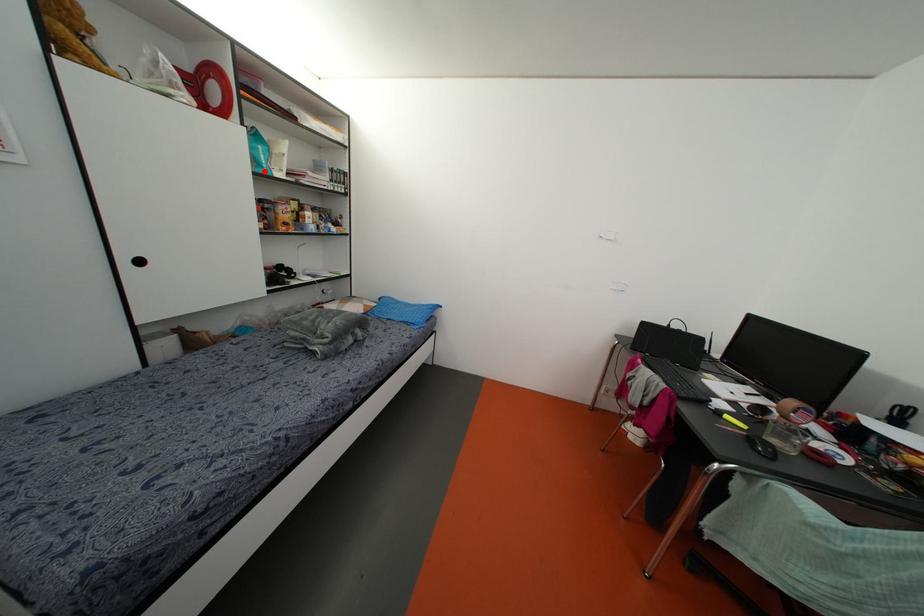
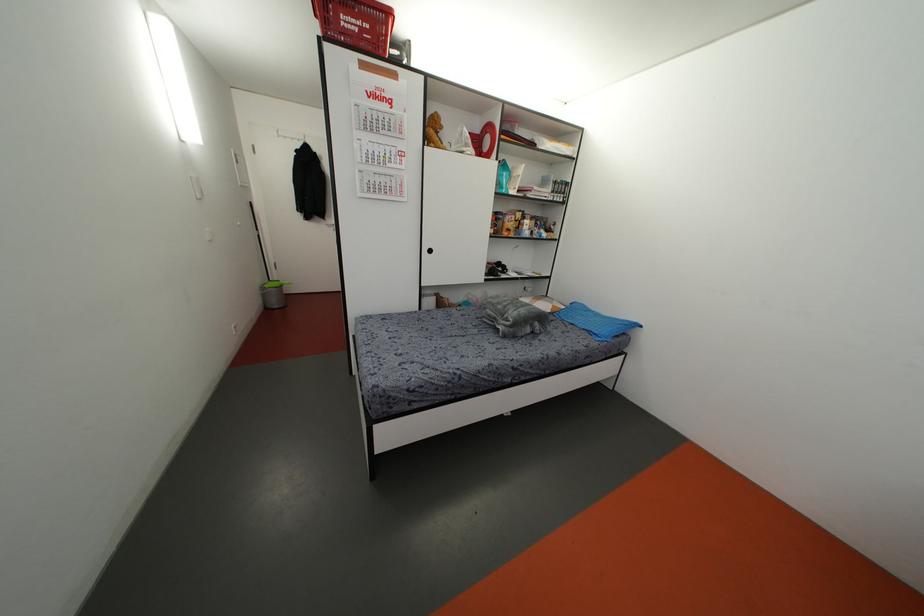
Locate, in the second image, the point that corresponds to the highlighted location in the first image.

(503, 191)